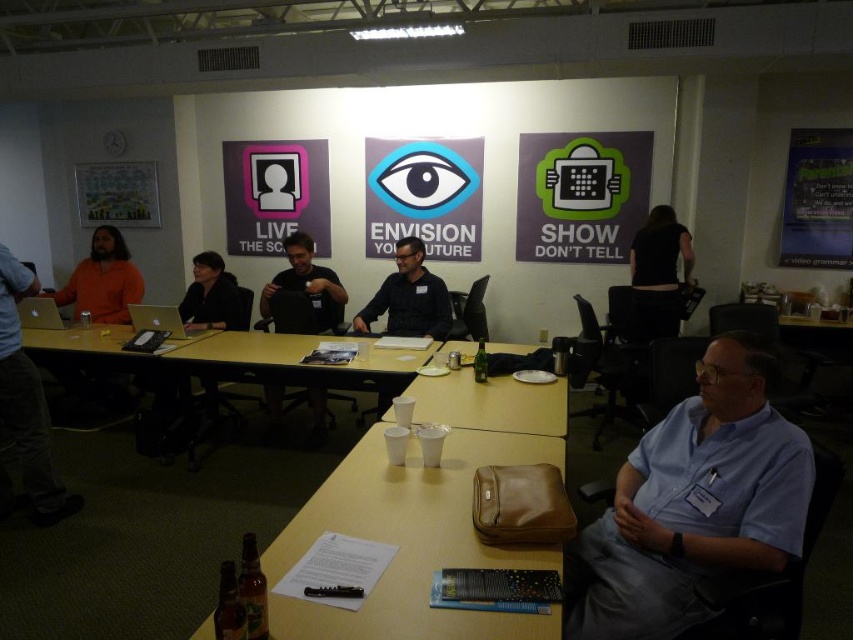
Question: Observing the image, what is the correct spatial positioning of white plastic cups at center in reference to silver metallic laptop at upper left?

Choices:
 (A) right
 (B) left

Answer: (A)

Question: Can you confirm if orange shirt at left is smaller than orange sweater at left?

Choices:
 (A) yes
 (B) no

Answer: (B)

Question: Considering the real-world distances, which object is farthest from the black fabric shirt at upper right?

Choices:
 (A) blue shirt at lower right
 (B) yellow matte table at center

Answer: (A)

Question: Which object is positioned closest to the yellow matte table at center?

Choices:
 (A) white plastic cups at center
 (B) silver metallic laptop at center
 (C) orange shirt at left

Answer: (A)

Question: Can you confirm if yellow wood table at center is wider than black fabric shirt at upper right?

Choices:
 (A) no
 (B) yes

Answer: (B)

Question: Estimate the real-world distances between objects in this image. Which object is closer to the yellow matte table at center?

Choices:
 (A) orange shirt at left
 (B) yellow wood table at center

Answer: (B)